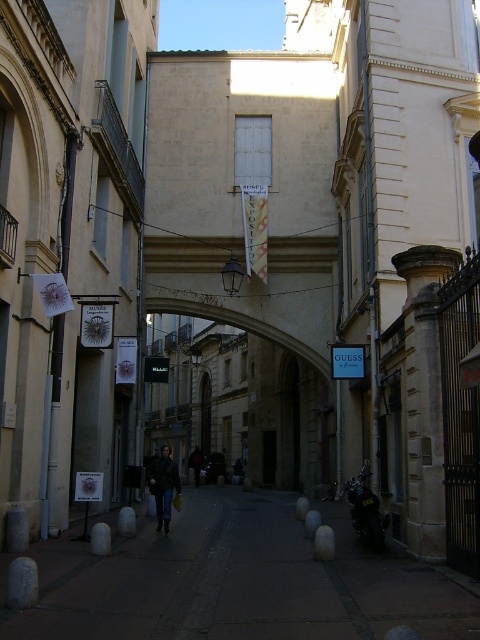
You are a delivery person carrying a large box that is 1.2 meters wide. You need to pass through the dark stone alley at center and the beige stone archway at center. Which path should you choose to ensure your box fits through?

The beige stone archway at center has a greater width than the dark stone alley at center, so you should choose the beige stone archway at center to ensure your box fits through.

You are a photographer trying to capture the beige stone archway at center and the dark brown leather jacket at center in the same frame. Can you see both objects clearly at the same time?

The dark brown leather jacket at center is behind the beige stone archway at center, so the jacket will be partially or fully obscured by the archway, making it difficult to see both clearly in the same frame.

You are a delivery person needing to place a package on the ground. The package must be placed exactly at point (164, 484). Is there enough space at that point to place the package without it being under any objects?

The dark brown leather jacket at center is located at point (164, 484). Therefore, placing the package there would require moving the jacket first.